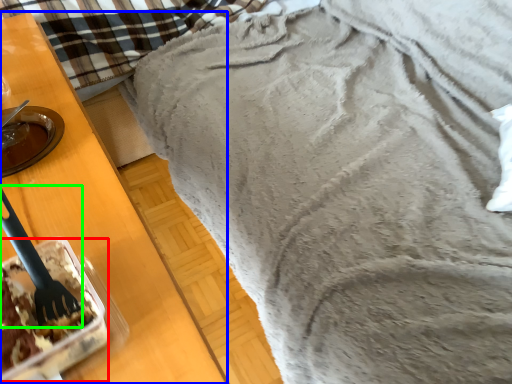
Question: Which object is positioned closest to dessert (highlighted by a red box)? Select from furniture (highlighted by a blue box) and silverware (highlighted by a green box).

Choices:
 (A) furniture
 (B) silverware

Answer: (B)